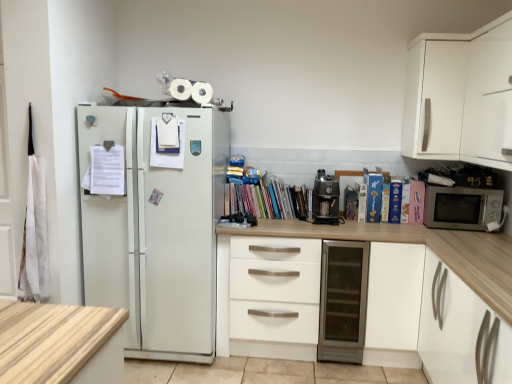
You are a GUI agent. You are given a task and a screenshot of the screen. Output one action in this format:
    pyautogui.click(x=<x>, y=<y>)
    Task: Click on the white matte cabinet at upper right, acting as the 1th cabinetry starting from the top
    This screenshot has height=384, width=512.
    Given the screenshot: What is the action you would take?
    pyautogui.click(x=459, y=95)

Find the location of a particular element. blue matte paperback book at upper right, positioned as the first paperback book in left-to-right order is located at coordinates (373, 196).

Find the location of a particular element. white matte cabinet at lower right, arranged as the 2th cabinetry when viewed from the top is located at coordinates (369, 294).

This screenshot has height=384, width=512. What do you see at coordinates (385, 197) in the screenshot? I see `hardcover book at right, which is the 4th paperback book in right-to-left order` at bounding box center [385, 197].

The image size is (512, 384). Find the location of `pink matte paperback book at right, acting as the 1th paperback book starting from the right`. pink matte paperback book at right, acting as the 1th paperback book starting from the right is located at coordinates (416, 202).

Identify the location of white matte cabinet at upper right, acting as the 1th cabinetry starting from the top. (459, 95).

Which object is further away from the camera taking this photo, silver metallic microwave at right or hardcover book at right, the 4th paperback book from the left?

hardcover book at right, the 4th paperback book from the left, is behind.

From a real-world perspective, is silver metallic microwave at right located beneath hardcover book at right, which is the 2th paperback book from right to left?

Yes, from a real-world perspective, silver metallic microwave at right is below hardcover book at right, which is the 2th paperback book from right to left.

Which is in front, point (477, 225) or point (405, 197)?

Point (477, 225)

In the scene shown: Considering the positions of objects silver metallic microwave at right and hardcover book at right, the 4th paperback book from the left, in the image provided, who is more to the left, silver metallic microwave at right or hardcover book at right, the 4th paperback book from the left,?

Positioned to the left is hardcover book at right, the 4th paperback book from the left.

Between white matte cabinet at upper right, the second cabinetry from the bottom, and blue matte paperback book at upper right, positioned as the first paperback book in left-to-right order, which one has larger width?

white matte cabinet at upper right, the second cabinetry from the bottom.

From a real-world perspective, is white matte cabinet at upper right, the second cabinetry from the bottom, physically above blue matte paperback book at upper right, which appears as the fifth paperback book when viewed from the right?

Yes, from a real-world perspective, white matte cabinet at upper right, the second cabinetry from the bottom, is above blue matte paperback book at upper right, which appears as the fifth paperback book when viewed from the right.

Is white matte cabinet at upper right, the second cabinetry from the bottom, closer to camera compared to blue matte paperback book at upper right, positioned as the first paperback book in left-to-right order?

Yes, the depth of white matte cabinet at upper right, the second cabinetry from the bottom, is less than that of blue matte paperback book at upper right, positioned as the first paperback book in left-to-right order.

Do you think white matte cabinet at upper right, acting as the 1th cabinetry starting from the top, is within blue matte paperback book at upper right, positioned as the first paperback book in left-to-right order, or outside of it?

white matte cabinet at upper right, acting as the 1th cabinetry starting from the top, is outside blue matte paperback book at upper right, positioned as the first paperback book in left-to-right order.

From the image's perspective, which is above, multicolored paperbacks at center or metallic glass door fridge at center?

From the image's view, multicolored paperbacks at center is above.

From a real-world perspective, which object stands above the other?

In real-world perspective, multicolored paperbacks at center is above.

Can you confirm if multicolored paperbacks at center is positioned to the left of metallic glass door fridge at center?

Yes, multicolored paperbacks at center is to the left of metallic glass door fridge at center.

Which object is positioned more to the right, hardcover book at right, the 4th paperback book from the left, or metallic glass door fridge at center?

hardcover book at right, the 4th paperback book from the left, is more to the right.

Consider the image. Which of these two, hardcover book at right, which is the 2th paperback book from right to left, or metallic glass door fridge at center, is smaller?

With smaller size is hardcover book at right, which is the 2th paperback book from right to left.

Considering the relative sizes of hardcover book at right, which is the 2th paperback book from right to left, and metallic glass door fridge at center in the image provided, is hardcover book at right, which is the 2th paperback book from right to left, shorter than metallic glass door fridge at center?

Yes, hardcover book at right, which is the 2th paperback book from right to left, is shorter than metallic glass door fridge at center.

Which object is thinner, pink matte paperback book at right, which is the 5th paperback book from left to right, or hardcover book at right, the third paperback book positioned from the left?

With smaller width is hardcover book at right, the third paperback book positioned from the left.

From the image's perspective, starting from the pink matte paperback book at right, acting as the 1th paperback book starting from the right, which paperback book is the 1st one below? Please provide its 2D coordinates.

[(395, 201)]

Is pink matte paperback book at right, which is the 5th paperback book from left to right, aimed at hardcover book at right, the third paperback book positioned from the left?

No, pink matte paperback book at right, which is the 5th paperback book from left to right, is not facing towards hardcover book at right, the third paperback book positioned from the left.

Considering the relative positions of pink matte paperback book at right, which is the 5th paperback book from left to right, and hardcover book at right, the third paperback book positioned from the left, in the image provided, is pink matte paperback book at right, which is the 5th paperback book from left to right, to the left of hardcover book at right, the third paperback book positioned from the left, from the viewer's perspective?

No.

Based on the photo, from a real-world perspective, is multicolored paperbacks at center positioned over white matte cabinet at lower right, arranged as the 2th cabinetry when viewed from the top, based on gravity?

Yes.

Can you confirm if multicolored paperbacks at center is smaller than white matte cabinet at lower right, marked as the first cabinetry in a bottom-to-top arrangement?

Correct, multicolored paperbacks at center occupies less space than white matte cabinet at lower right, marked as the first cabinetry in a bottom-to-top arrangement.

Can you confirm if multicolored paperbacks at center is shorter than white matte cabinet at lower right, arranged as the 2th cabinetry when viewed from the top?

Yes.

Considering the relative positions of multicolored paperbacks at center and white matte cabinet at lower right, marked as the first cabinetry in a bottom-to-top arrangement, in the image provided, is multicolored paperbacks at center to the left or to the right of white matte cabinet at lower right, marked as the first cabinetry in a bottom-to-top arrangement,?

From the image, it's evident that multicolored paperbacks at center is to the left of white matte cabinet at lower right, marked as the first cabinetry in a bottom-to-top arrangement.

Considering the positions of objects white matte cabinet at upper right, acting as the 1th cabinetry starting from the top, and silver metallic microwave at right in the image provided, who is more to the left, white matte cabinet at upper right, acting as the 1th cabinetry starting from the top, or silver metallic microwave at right?

From the viewer's perspective, white matte cabinet at upper right, acting as the 1th cabinetry starting from the top, appears more on the left side.

From the picture: Which of these two, white matte cabinet at upper right, acting as the 1th cabinetry starting from the top, or silver metallic microwave at right, is bigger?

Bigger between the two is white matte cabinet at upper right, acting as the 1th cabinetry starting from the top.

From the image's perspective, which object appears higher, white matte cabinet at upper right, the second cabinetry from the bottom, or silver metallic microwave at right?

white matte cabinet at upper right, the second cabinetry from the bottom.

This screenshot has width=512, height=384. In order to click on the 2nd paperback book to the left of the silver metallic microwave at right, counting from the anchor's position in this screenshot , I will do `click(405, 202)`.

Identify the location of the 1st cabinetry in front of the blue matte paperback book at upper right, positioned as the first paperback book in left-to-right order. coord(459,95).

Looking at this image, when comparing their distances from blue matte paperback book at upper right, which appears as the fifth paperback book when viewed from the right, does satin black coffee machine at center or pink matte paperback book at right, which is the 5th paperback book from left to right, seem further?

satin black coffee machine at center is further to blue matte paperback book at upper right, which appears as the fifth paperback book when viewed from the right.

From the image, which object appears to be farther from hardcover book at right, the 4th paperback book from the left, multicolored paperbacks at center or pink matte paperback book at right, which is the 5th paperback book from left to right?

Among the two, multicolored paperbacks at center is located further to hardcover book at right, the 4th paperback book from the left.

Which object lies further to the anchor point hardcover book at right, which is the 4th paperback book in right-to-left order, metallic glass door fridge at center or multicolored paperbacks at center?

multicolored paperbacks at center.

Considering their positions, is satin black coffee machine at center positioned further to multicolored paperbacks at center than blue matte paperback book at upper right, which appears as the fifth paperback book when viewed from the right?

Among the two, blue matte paperback book at upper right, which appears as the fifth paperback book when viewed from the right, is located further to multicolored paperbacks at center.

Considering their positions, is white matte cabinet at lower right, marked as the first cabinetry in a bottom-to-top arrangement, positioned further to metallic glass door fridge at center than white matte cabinet at upper right, the second cabinetry from the bottom?

white matte cabinet at upper right, the second cabinetry from the bottom, is further to metallic glass door fridge at center.

From the image, which object appears to be farther from white matte cabinet at upper right, acting as the 1th cabinetry starting from the top, hardcover book at right, the third paperback book positioned from the left, or hardcover book at right, which ranks as the 2th paperback book in left-to-right order?

hardcover book at right, which ranks as the 2th paperback book in left-to-right order, lies further to white matte cabinet at upper right, acting as the 1th cabinetry starting from the top, than the other object.

Which object lies further to the anchor point hardcover book at right, positioned as the third paperback book in right-to-left order, white matte cabinet at lower right, arranged as the 2th cabinetry when viewed from the top, or blue matte paperback book at upper right, positioned as the first paperback book in left-to-right order?

Based on the image, white matte cabinet at lower right, arranged as the 2th cabinetry when viewed from the top, appears to be further to hardcover book at right, positioned as the third paperback book in right-to-left order.

Which object lies nearer to the anchor point white matte cabinet at lower right, arranged as the 2th cabinetry when viewed from the top, hardcover book at right, which ranks as the 2th paperback book in left-to-right order, or satin black coffee machine at center?

satin black coffee machine at center lies closer to white matte cabinet at lower right, arranged as the 2th cabinetry when viewed from the top, than the other object.

You are a GUI agent. You are given a task and a screenshot of the screen. Output one action in this format:
    pyautogui.click(x=<x>, y=<y>)
    Task: Click on the microwave oven between pink matte paperback book at right, acting as the 1th paperback book starting from the right, and white matte cabinet at lower right, arranged as the 2th cabinetry when viewed from the top, from top to bottom
    The image size is (512, 384).
    Given the screenshot: What is the action you would take?
    pyautogui.click(x=462, y=207)

This screenshot has width=512, height=384. In order to click on paperback book between hardcover book at right, the 4th paperback book from the left, and white matte cabinet at lower right, arranged as the 2th cabinetry when viewed from the top, in the up-down direction in this screenshot , I will do `click(385, 197)`.

Where is `paperback book between hardcover book at right, positioned as the third paperback book in right-to-left order, and pink matte paperback book at right, which is the 5th paperback book from left to right`? paperback book between hardcover book at right, positioned as the third paperback book in right-to-left order, and pink matte paperback book at right, which is the 5th paperback book from left to right is located at coordinates (405, 202).

This screenshot has height=384, width=512. What are the coordinates of `appliance between white matte cabinet at upper right, the second cabinetry from the bottom, and white matte chest of drawers at center in the up-down direction` in the screenshot? It's located at (325, 199).